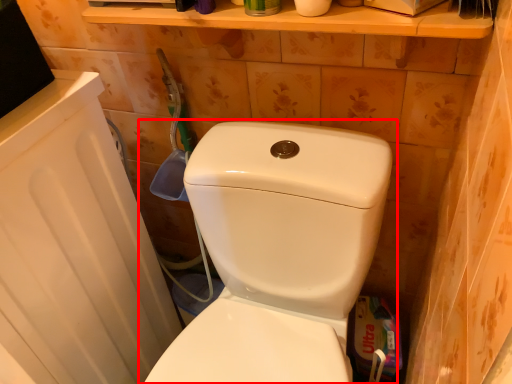
Question: From the image's perspective, what is the correct spatial positioning of toilet (annotated by the red box) in reference to toilet paper?

Choices:
 (A) below
 (B) above

Answer: (A)